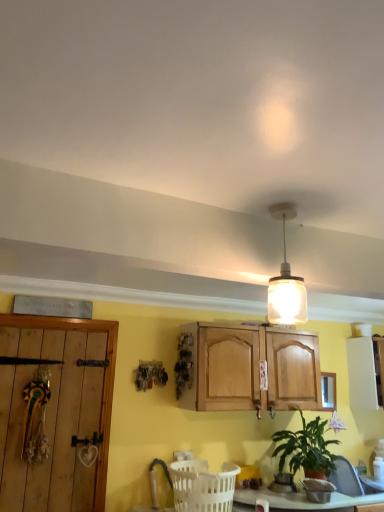
Question: Would you say white matte cabinet at right is inside or outside translucent glass pendant light at upper center?

Choices:
 (A) inside
 (B) outside

Answer: (B)

Question: Visually, is white matte cabinet at right positioned to the left or to the right of translucent glass pendant light at upper center?

Choices:
 (A) right
 (B) left

Answer: (A)

Question: Estimate the real-world distances between objects in this image. Which object is farther from the green matte plant at lower right?

Choices:
 (A) white plastic basket at lower center
 (B) clear glass window at upper right
 (C) translucent glass pendant light at upper center
 (D) white matte cabinet at right

Answer: (C)

Question: Which object is the farthest from the translucent glass pendant light at upper center?

Choices:
 (A) green matte plant at lower right
 (B) clear glass window at upper right
 (C) white plastic basket at lower center
 (D) white matte cabinet at right

Answer: (D)